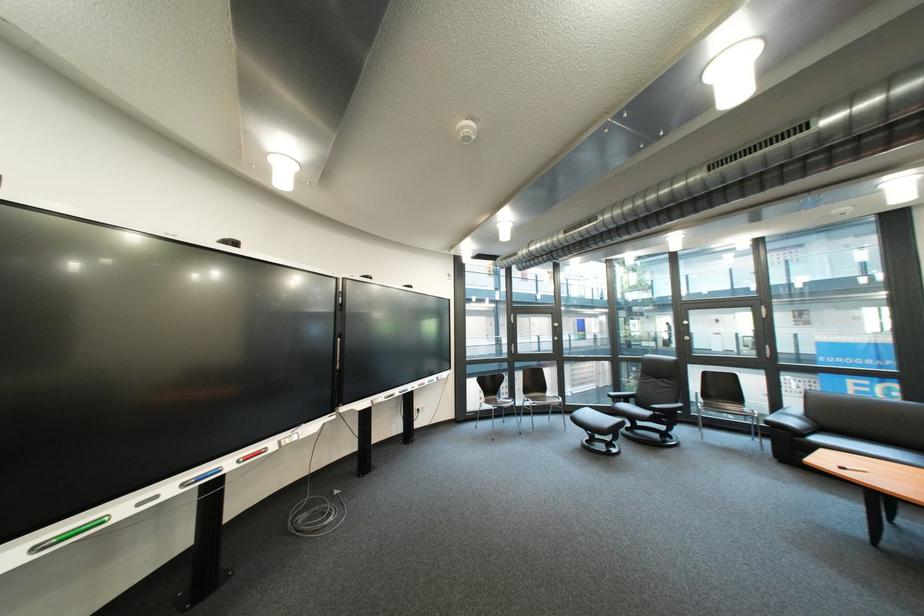
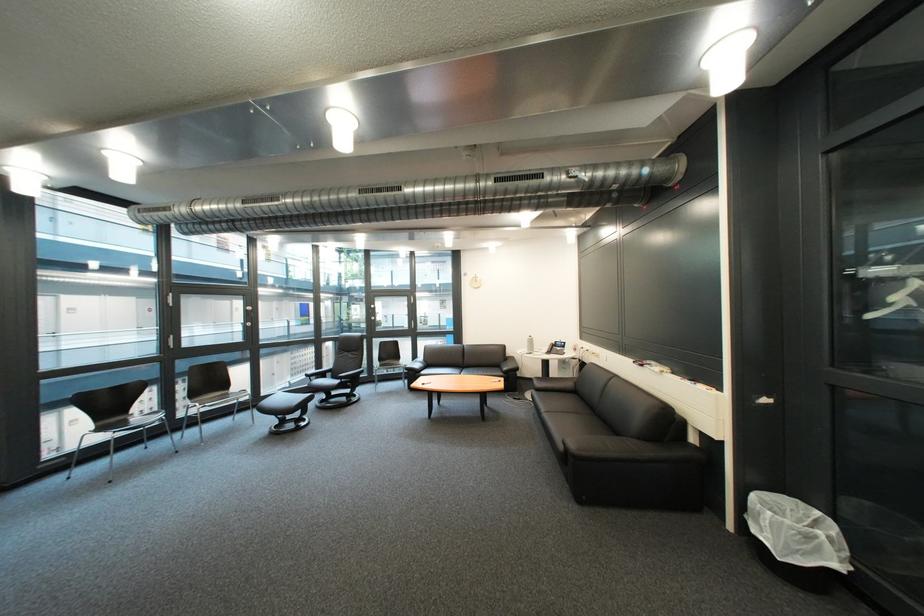
Question: The camera is either moving clockwise (left) or counter-clockwise (right) around the object. The first image is from the beginning of the video and the second image is from the end. Is the camera moving left or right when shooting the video?

Choices:
 (A) Left
 (B) Right

Answer: (A)